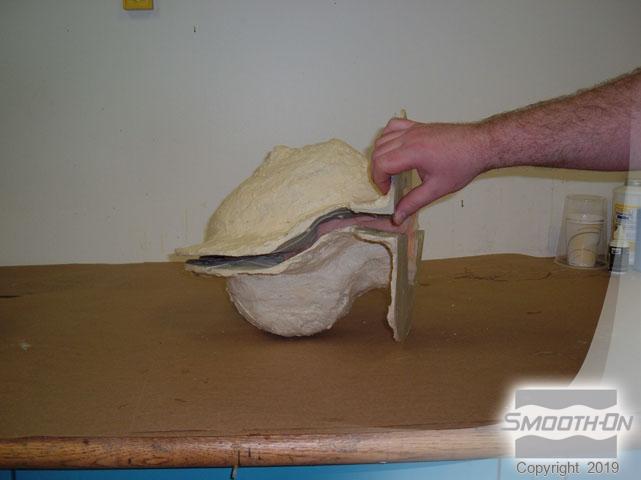
Find the location of `wall`. wall is located at coordinates (270, 31).